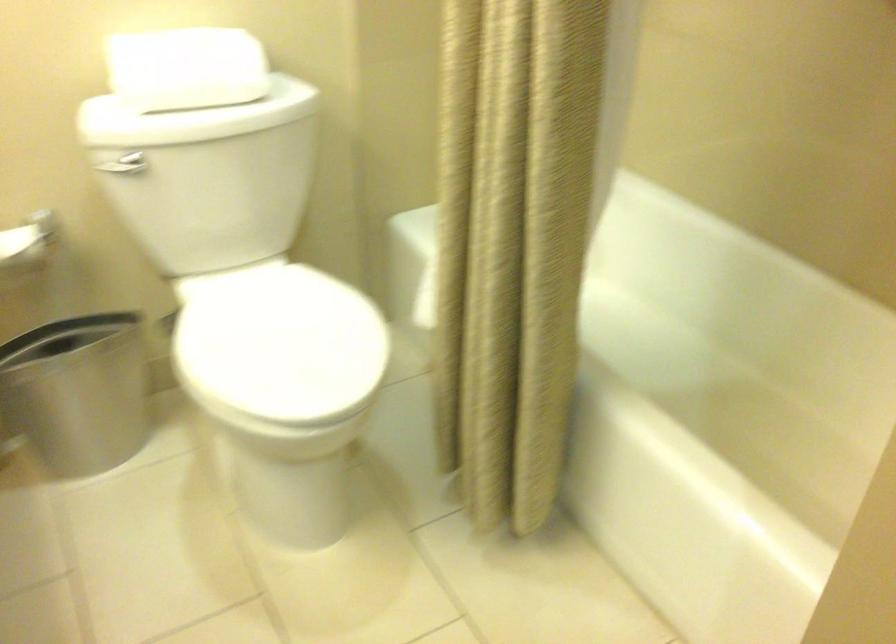
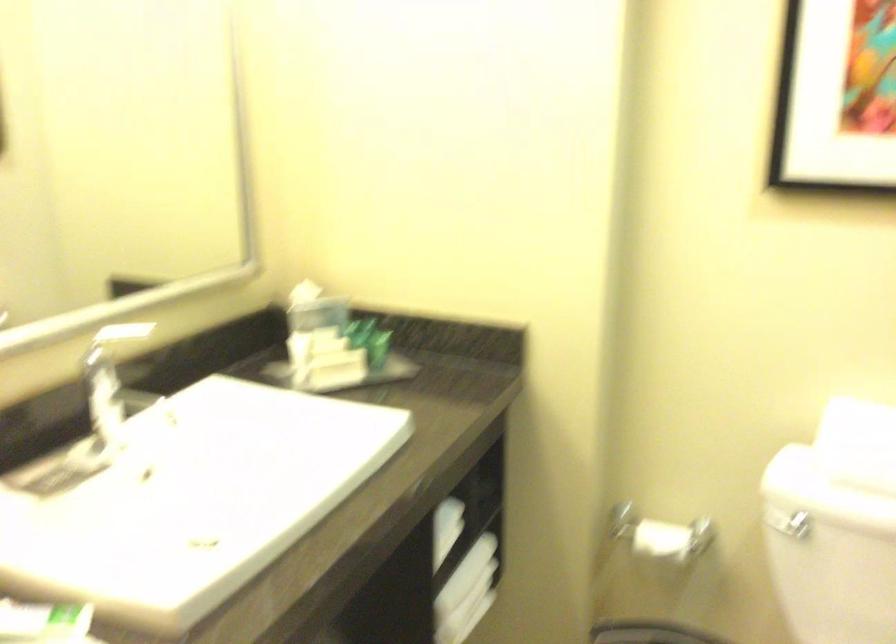
Locate, in the second image, the point that corresponds to point 126,167 in the first image.

(788, 524)